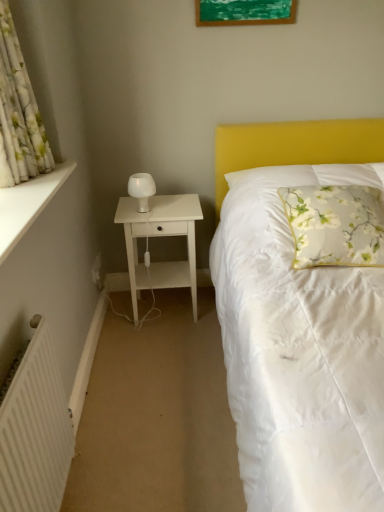
Question: Is green matte picture frame at upper center facing away from floral fabric pillow at center?

Choices:
 (A) no
 (B) yes

Answer: (A)

Question: Does green matte picture frame at upper center appear on the right side of floral fabric pillow at center?

Choices:
 (A) yes
 (B) no

Answer: (B)

Question: Does green matte picture frame at upper center have a larger size compared to floral fabric pillow at center?

Choices:
 (A) no
 (B) yes

Answer: (A)

Question: Is green matte picture frame at upper center directly adjacent to floral fabric pillow at center?

Choices:
 (A) no
 (B) yes

Answer: (A)

Question: From the image's perspective, is green matte picture frame at upper center under floral fabric pillow at center?

Choices:
 (A) yes
 (B) no

Answer: (B)

Question: From the image's perspective, relative to white matte radiator at lower left, is white matte nightstand at left above or below?

Choices:
 (A) above
 (B) below

Answer: (A)

Question: From a real-world perspective, is white matte nightstand at left positioned above or below white matte radiator at lower left?

Choices:
 (A) above
 (B) below

Answer: (B)

Question: In terms of size, does white matte nightstand at left appear bigger or smaller than white matte radiator at lower left?

Choices:
 (A) small
 (B) big

Answer: (B)

Question: Based on their positions, is white matte nightstand at left located to the left or right of white matte radiator at lower left?

Choices:
 (A) left
 (B) right

Answer: (B)

Question: Looking at their shapes, would you say floral fabric pillow at center is wider or thinner than white matte nightstand at left?

Choices:
 (A) thin
 (B) wide

Answer: (B)

Question: Considering the positions of floral fabric pillow at center and white matte nightstand at left in the image, is floral fabric pillow at center taller or shorter than white matte nightstand at left?

Choices:
 (A) tall
 (B) short

Answer: (B)

Question: From a real-world perspective, relative to white matte nightstand at left, is floral fabric pillow at center vertically above or below?

Choices:
 (A) below
 (B) above

Answer: (B)

Question: Would you say floral fabric pillow at center is inside or outside white matte nightstand at left?

Choices:
 (A) inside
 (B) outside

Answer: (B)

Question: Considering the positions of white matte radiator at lower left and white matte nightstand at left in the image, is white matte radiator at lower left wider or thinner than white matte nightstand at left?

Choices:
 (A) thin
 (B) wide

Answer: (A)

Question: Is white matte radiator at lower left inside or outside of white matte nightstand at left?

Choices:
 (A) inside
 (B) outside

Answer: (B)